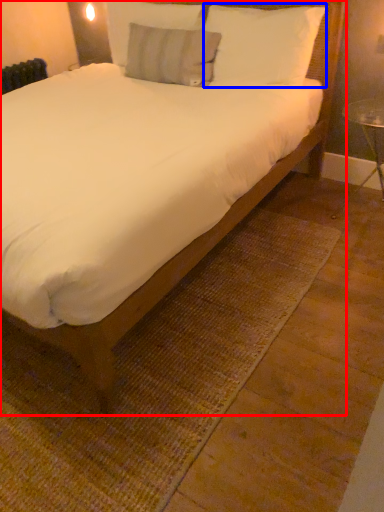
Question: Which of the following is the closest to the observer, bed (highlighted by a red box) or pillow (highlighted by a blue box)?

Choices:
 (A) bed
 (B) pillow

Answer: (A)